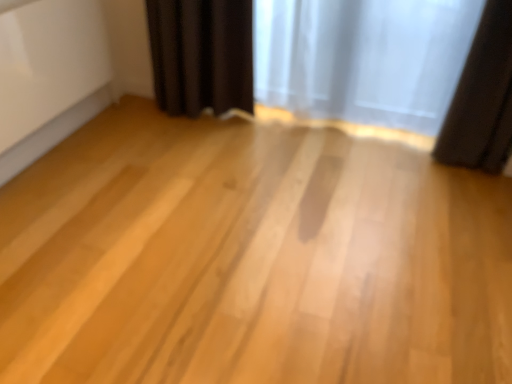
The width and height of the screenshot is (512, 384). Describe the element at coordinates (362, 58) in the screenshot. I see `translucent fabric curtain at upper right, positioned as the 2th curtain in right-to-left order` at that location.

Measure the distance between point (x=405, y=92) and camera.

The distance of point (x=405, y=92) from camera is 8.81 feet.

Find the location of `translucent fabric curtain at upper right, positioned as the 2th curtain in right-to-left order`. translucent fabric curtain at upper right, positioned as the 2th curtain in right-to-left order is located at coordinates (362, 58).

Consider the image. Measure the distance between point (488, 48) and camera.

Point (488, 48) is 7.28 feet from camera.

Describe the element at coordinates (482, 98) in the screenshot. Image resolution: width=512 pixels, height=384 pixels. I see `dark matte curtain at right, which is the 1th curtain in right-to-left order` at that location.

Where is `dark matte curtain at right, which is the 1th curtain in right-to-left order`? The height and width of the screenshot is (384, 512). dark matte curtain at right, which is the 1th curtain in right-to-left order is located at coordinates (482, 98).

What is the approximate width of dark matte curtain at right, which is the 1th curtain in right-to-left order?

It is 23.94 centimeters.

The image size is (512, 384). I want to click on translucent fabric curtain at upper right, positioned as the 2th curtain in right-to-left order, so click(x=362, y=58).

Which is more to the left, translucent fabric curtain at upper right, positioned as the 2th curtain in right-to-left order, or dark matte curtain at right, which is the 1th curtain in right-to-left order?

From the viewer's perspective, translucent fabric curtain at upper right, positioned as the 2th curtain in right-to-left order, appears more on the left side.

Consider the image. Considering the positions of objects translucent fabric curtain at upper right, which is counted as the first curtain, starting from the left, and dark matte curtain at right, which is the 1th curtain in right-to-left order, in the image provided, who is in front, translucent fabric curtain at upper right, which is counted as the first curtain, starting from the left, or dark matte curtain at right, which is the 1th curtain in right-to-left order,?

dark matte curtain at right, which is the 1th curtain in right-to-left order, is more forward.

Between point (316, 97) and point (473, 163), which one is positioned in front?

Positioned in front is point (473, 163).

From the image's perspective, which is above, translucent fabric curtain at upper right, which is counted as the first curtain, starting from the left, or dark matte curtain at right, the 2th curtain from the left?

translucent fabric curtain at upper right, which is counted as the first curtain, starting from the left.

From a real-world perspective, is translucent fabric curtain at upper right, which is counted as the first curtain, starting from the left, physically above dark matte curtain at right, the 2th curtain from the left?

No, from a real-world perspective, translucent fabric curtain at upper right, which is counted as the first curtain, starting from the left, is not above dark matte curtain at right, the 2th curtain from the left.

Considering the sizes of translucent fabric curtain at upper right, which is counted as the first curtain, starting from the left, and dark matte curtain at right, the 2th curtain from the left, in the image, is translucent fabric curtain at upper right, which is counted as the first curtain, starting from the left, wider or thinner than dark matte curtain at right, the 2th curtain from the left,?

Considering their sizes, translucent fabric curtain at upper right, which is counted as the first curtain, starting from the left, looks slimmer than dark matte curtain at right, the 2th curtain from the left.

Is translucent fabric curtain at upper right, which is counted as the first curtain, starting from the left, taller or shorter than dark matte curtain at right, the 2th curtain from the left?

In the image, translucent fabric curtain at upper right, which is counted as the first curtain, starting from the left, appears to be shorter than dark matte curtain at right, the 2th curtain from the left.

Based on the photo, who is bigger, translucent fabric curtain at upper right, positioned as the 2th curtain in right-to-left order, or dark matte curtain at right, which is the 1th curtain in right-to-left order?

Bigger between the two is translucent fabric curtain at upper right, positioned as the 2th curtain in right-to-left order.

Would you say translucent fabric curtain at upper right, positioned as the 2th curtain in right-to-left order, is inside or outside dark matte curtain at right, which is the 1th curtain in right-to-left order?

translucent fabric curtain at upper right, positioned as the 2th curtain in right-to-left order, is not enclosed by dark matte curtain at right, which is the 1th curtain in right-to-left order.

Are translucent fabric curtain at upper right, which is counted as the first curtain, starting from the left, and dark matte curtain at right, which is the 1th curtain in right-to-left order, far apart?

translucent fabric curtain at upper right, which is counted as the first curtain, starting from the left, is actually quite close to dark matte curtain at right, which is the 1th curtain in right-to-left order.

Is translucent fabric curtain at upper right, positioned as the 2th curtain in right-to-left order, facing towards dark matte curtain at right, which is the 1th curtain in right-to-left order?

No, translucent fabric curtain at upper right, positioned as the 2th curtain in right-to-left order, does not turn towards dark matte curtain at right, which is the 1th curtain in right-to-left order.

How different are the orientations of translucent fabric curtain at upper right, positioned as the 2th curtain in right-to-left order, and dark matte curtain at right, the 2th curtain from the left, in degrees?

1.81 degrees.

Where is `curtain in front of the translucent fabric curtain at upper right, positioned as the 2th curtain in right-to-left order`? curtain in front of the translucent fabric curtain at upper right, positioned as the 2th curtain in right-to-left order is located at coordinates [x=482, y=98].

In the scene shown: Considering the relative positions of dark matte curtain at right, the 2th curtain from the left, and translucent fabric curtain at upper right, positioned as the 2th curtain in right-to-left order, in the image provided, is dark matte curtain at right, the 2th curtain from the left, to the left or to the right of translucent fabric curtain at upper right, positioned as the 2th curtain in right-to-left order,?

dark matte curtain at right, the 2th curtain from the left, is to the right of translucent fabric curtain at upper right, positioned as the 2th curtain in right-to-left order.

Which is behind, dark matte curtain at right, the 2th curtain from the left, or translucent fabric curtain at upper right, positioned as the 2th curtain in right-to-left order?

translucent fabric curtain at upper right, positioned as the 2th curtain in right-to-left order, is further from the camera.

Between point (511, 23) and point (434, 16), which one is positioned in front?

The point (511, 23) is more forward.

From the image's perspective, would you say dark matte curtain at right, which is the 1th curtain in right-to-left order, is positioned over translucent fabric curtain at upper right, positioned as the 2th curtain in right-to-left order?

No.

From a real-world perspective, between dark matte curtain at right, which is the 1th curtain in right-to-left order, and translucent fabric curtain at upper right, which is counted as the first curtain, starting from the left, who is vertically higher?

dark matte curtain at right, which is the 1th curtain in right-to-left order, is physically above.

Is dark matte curtain at right, which is the 1th curtain in right-to-left order, wider than translucent fabric curtain at upper right, which is counted as the first curtain, starting from the left?

Correct, the width of dark matte curtain at right, which is the 1th curtain in right-to-left order, exceeds that of translucent fabric curtain at upper right, which is counted as the first curtain, starting from the left.

Does dark matte curtain at right, which is the 1th curtain in right-to-left order, have a lesser height compared to translucent fabric curtain at upper right, which is counted as the first curtain, starting from the left?

In fact, dark matte curtain at right, which is the 1th curtain in right-to-left order, may be taller than translucent fabric curtain at upper right, which is counted as the first curtain, starting from the left.

Which of these two, dark matte curtain at right, which is the 1th curtain in right-to-left order, or translucent fabric curtain at upper right, positioned as the 2th curtain in right-to-left order, is bigger?

translucent fabric curtain at upper right, positioned as the 2th curtain in right-to-left order.

Could translucent fabric curtain at upper right, which is counted as the first curtain, starting from the left, be considered to be inside dark matte curtain at right, the 2th curtain from the left?

No, translucent fabric curtain at upper right, which is counted as the first curtain, starting from the left, is located outside of dark matte curtain at right, the 2th curtain from the left.

Is dark matte curtain at right, which is the 1th curtain in right-to-left order, directly adjacent to translucent fabric curtain at upper right, positioned as the 2th curtain in right-to-left order?

No, dark matte curtain at right, which is the 1th curtain in right-to-left order, is not beside translucent fabric curtain at upper right, positioned as the 2th curtain in right-to-left order.

Is dark matte curtain at right, which is the 1th curtain in right-to-left order, oriented away from translucent fabric curtain at upper right, which is counted as the first curtain, starting from the left?

dark matte curtain at right, which is the 1th curtain in right-to-left order, does not have its back to translucent fabric curtain at upper right, which is counted as the first curtain, starting from the left.

Measure the distance between dark matte curtain at right, the 2th curtain from the left, and translucent fabric curtain at upper right, positioned as the 2th curtain in right-to-left order.

A distance of 18.56 inches exists between dark matte curtain at right, the 2th curtain from the left, and translucent fabric curtain at upper right, positioned as the 2th curtain in right-to-left order.

Locate an element on the screen. Image resolution: width=512 pixels, height=384 pixels. curtain in front of the translucent fabric curtain at upper right, which is counted as the first curtain, starting from the left is located at coordinates (482, 98).

This screenshot has height=384, width=512. What are the coordinates of `curtain beneath the dark matte curtain at right, the 2th curtain from the left (from a real-world perspective)` in the screenshot? It's located at (362, 58).

The width and height of the screenshot is (512, 384). I want to click on curtain in front of the translucent fabric curtain at upper right, positioned as the 2th curtain in right-to-left order, so click(482, 98).